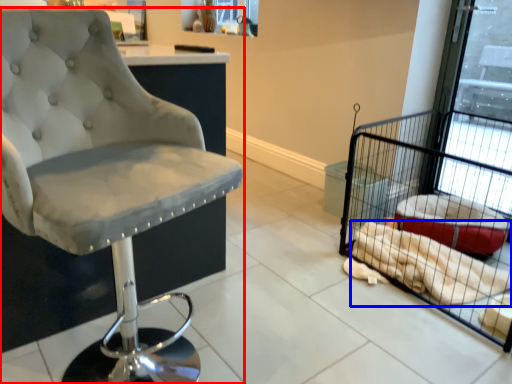
Question: Which object is further to the camera taking this photo, chair (highlighted by a red box) or material (highlighted by a blue box)?

Choices:
 (A) chair
 (B) material

Answer: (B)